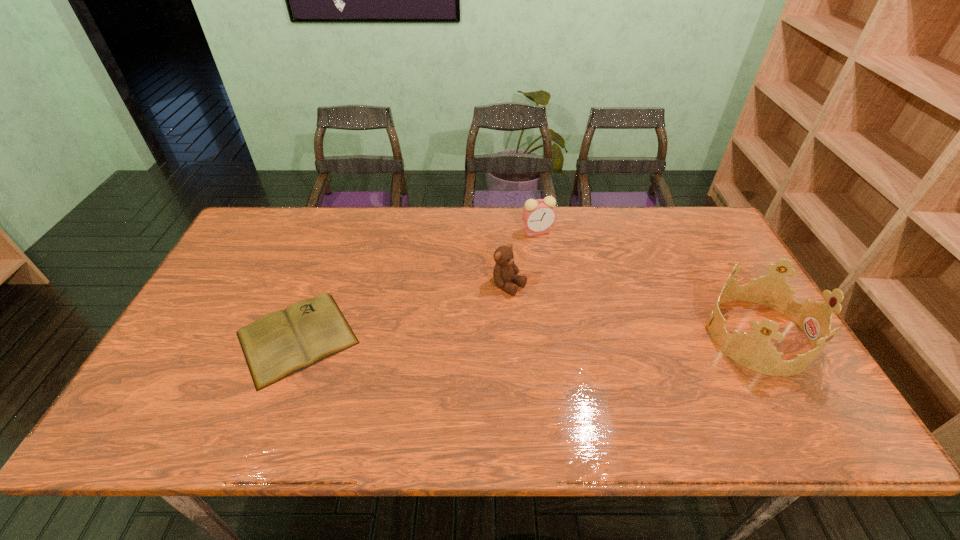
You are a GUI agent. You are given a task and a screenshot of the screen. Output one action in this format:
    pyautogui.click(x=<x>, y=<y>)
    Task: Click on the shortest object
    This screenshot has height=540, width=960.
    Given the screenshot: What is the action you would take?
    pyautogui.click(x=283, y=342)

Find the location of a particular element. Image resolution: width=960 pixels, height=540 pixels. book is located at coordinates (283, 342).

This screenshot has height=540, width=960. What are the coordinates of `tiara` in the screenshot? It's located at 754,351.

Identify the location of the rightmost object. Image resolution: width=960 pixels, height=540 pixels. (754, 351).

This screenshot has width=960, height=540. I want to click on the third object from left to right, so click(x=538, y=215).

Find the location of a particular element. The height and width of the screenshot is (540, 960). alarm clock is located at coordinates click(x=538, y=215).

Identify the location of teddy bear. (505, 270).

You are a GUI agent. You are given a task and a screenshot of the screen. Output one action in this format:
    pyautogui.click(x=<x>, y=<y>)
    Task: Click on the vacant area situated on the right of the shortest object
    Image resolution: width=960 pixels, height=540 pixels.
    Given the screenshot: What is the action you would take?
    pyautogui.click(x=411, y=338)

Where is `vacant area situated on the face of the farthest object`? vacant area situated on the face of the farthest object is located at coordinates (494, 297).

This screenshot has width=960, height=540. Find the location of `vacant space located on the face of the farthest object`. vacant space located on the face of the farthest object is located at coordinates (513, 267).